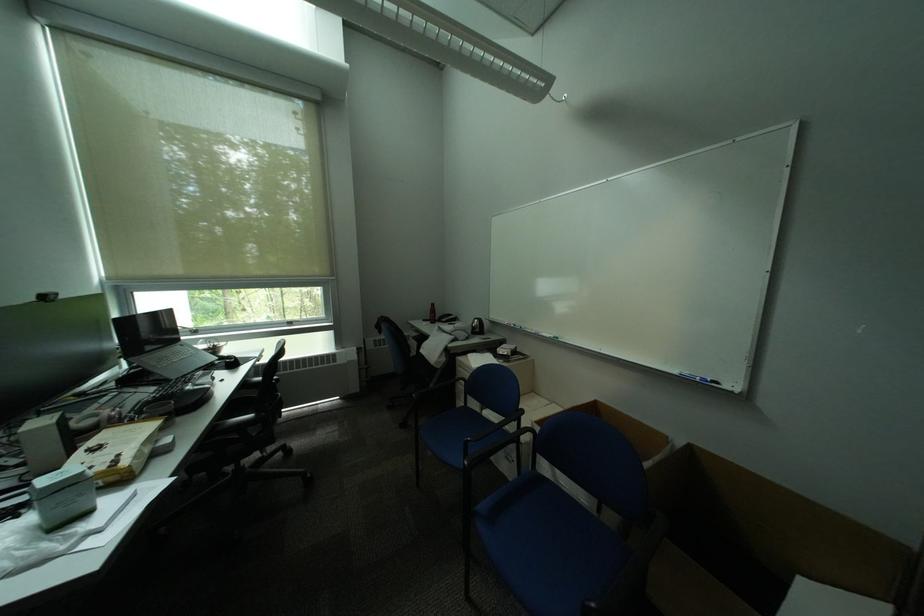
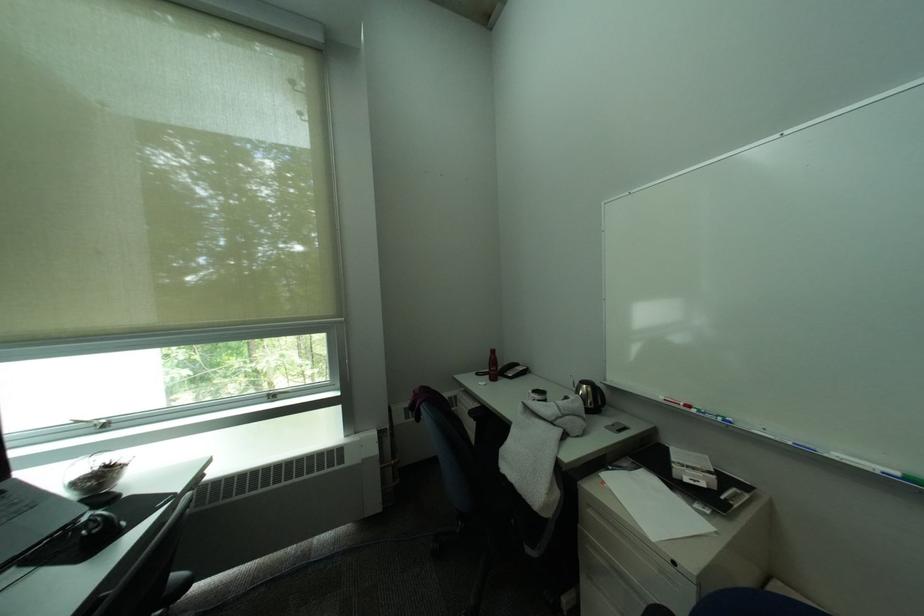
Question: I am providing you with two images of the same scene from different viewpoints. Please identify which objects are invisible in image2.

Choices:
 (A) silver window latch
 (B) whiteboard marker
 (C) telephone handset
 (D) none of these

Answer: (D)